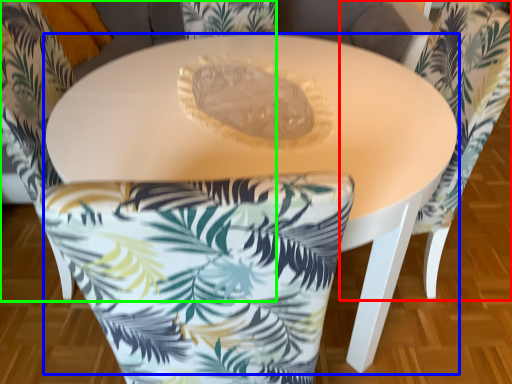
Question: Which object is the closest to the chair (highlighted by a red box)? Choose among these: table (highlighted by a blue box) or chair (highlighted by a green box).

Choices:
 (A) table
 (B) chair

Answer: (A)